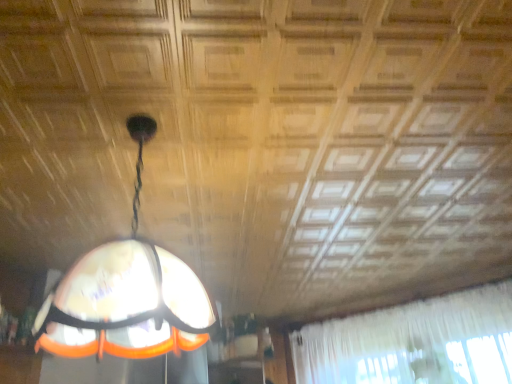
Locate an element on the screen. The width and height of the screenshot is (512, 384). white sheer curtain at upper right is located at coordinates (413, 342).

The width and height of the screenshot is (512, 384). Describe the element at coordinates (413, 342) in the screenshot. I see `white sheer curtain at upper right` at that location.

What do you see at coordinates (126, 295) in the screenshot? The image size is (512, 384). I see `translucent glass lampshade at center` at bounding box center [126, 295].

In order to click on translucent glass lampshade at center in this screenshot , I will do `click(126, 295)`.

Image resolution: width=512 pixels, height=384 pixels. Identify the location of white sheer curtain at upper right. (413, 342).

Considering the positions of objects white sheer curtain at upper right and translucent glass lampshade at center in the image provided, who is more to the left, white sheer curtain at upper right or translucent glass lampshade at center?

translucent glass lampshade at center.

Considering the positions of objects white sheer curtain at upper right and translucent glass lampshade at center in the image provided, who is behind, white sheer curtain at upper right or translucent glass lampshade at center?

white sheer curtain at upper right is further from the camera.

Is point (490, 367) positioned before point (88, 310)?

No, (490, 367) is behind (88, 310).

From the picture: From the image's perspective, is white sheer curtain at upper right above or below translucent glass lampshade at center?

Based on their image positions, white sheer curtain at upper right is located beneath translucent glass lampshade at center.

From a real-world perspective, is white sheer curtain at upper right under translucent glass lampshade at center?

Indeed, from a real-world perspective, white sheer curtain at upper right is positioned beneath translucent glass lampshade at center.

Between white sheer curtain at upper right and translucent glass lampshade at center, which one has larger width?

With larger width is translucent glass lampshade at center.

From the picture: Is white sheer curtain at upper right taller than translucent glass lampshade at center?

Yes.

Is white sheer curtain at upper right smaller than translucent glass lampshade at center?

Actually, white sheer curtain at upper right might be larger than translucent glass lampshade at center.

Is translucent glass lampshade at center located within white sheer curtain at upper right?

No, translucent glass lampshade at center is not surrounded by white sheer curtain at upper right.

Is white sheer curtain at upper right touching translucent glass lampshade at center?

No.

Is white sheer curtain at upper right facing away from translucent glass lampshade at center?

No, white sheer curtain at upper right's orientation is not away from translucent glass lampshade at center.

In the scene shown: What's the angular difference between white sheer curtain at upper right and translucent glass lampshade at center's facing directions?

180 degrees.

Locate an element on the screen. curtain below the translucent glass lampshade at center (from the image's perspective) is located at coordinates (413, 342).

Considering the positions of objects translucent glass lampshade at center and white sheer curtain at upper right in the image provided, who is more to the left, translucent glass lampshade at center or white sheer curtain at upper right?

Positioned to the left is translucent glass lampshade at center.

Considering the positions of objects translucent glass lampshade at center and white sheer curtain at upper right in the image provided, who is in front, translucent glass lampshade at center or white sheer curtain at upper right?

translucent glass lampshade at center is in front.

Which is farther from the camera, (83, 298) or (431, 326)?

The point (431, 326) is farther from the camera.

From the image's perspective, relative to white sheer curtain at upper right, is translucent glass lampshade at center above or below?

Based on their image positions, translucent glass lampshade at center is located above white sheer curtain at upper right.

From a real-world perspective, is translucent glass lampshade at center positioned under white sheer curtain at upper right based on gravity?

No, from a real-world perspective, translucent glass lampshade at center is not beneath white sheer curtain at upper right.

Which of these two, translucent glass lampshade at center or white sheer curtain at upper right, is wider?

translucent glass lampshade at center is wider.

Is translucent glass lampshade at center shorter than white sheer curtain at upper right?

Yes.

Does translucent glass lampshade at center have a larger size compared to white sheer curtain at upper right?

Incorrect, translucent glass lampshade at center is not larger than white sheer curtain at upper right.

Looking at this image, is translucent glass lampshade at center inside the boundaries of white sheer curtain at upper right, or outside?

translucent glass lampshade at center is outside white sheer curtain at upper right.

Are translucent glass lampshade at center and white sheer curtain at upper right making contact?

No, translucent glass lampshade at center is not touching white sheer curtain at upper right.

Is translucent glass lampshade at center positioned with its back to white sheer curtain at upper right?

No.

How much distance is there between translucent glass lampshade at center and white sheer curtain at upper right?

translucent glass lampshade at center and white sheer curtain at upper right are 2.66 meters apart from each other.

I want to click on curtain behind the translucent glass lampshade at center, so click(413, 342).

The height and width of the screenshot is (384, 512). Identify the location of curtain on the right of the translucent glass lampshade at center. (413, 342).

Identify the location of lamp located in front of the white sheer curtain at upper right. Image resolution: width=512 pixels, height=384 pixels. (126, 295).